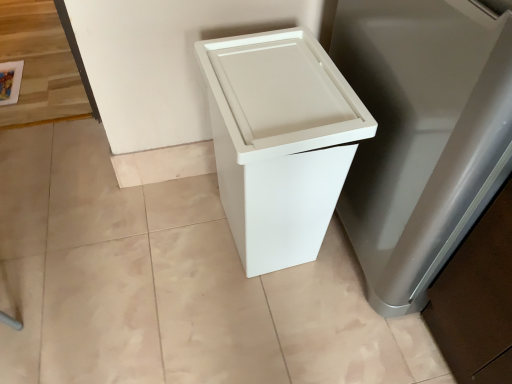
Locate an element on the screen. The height and width of the screenshot is (384, 512). free location in front of white matte trash can at center is located at coordinates (263, 323).